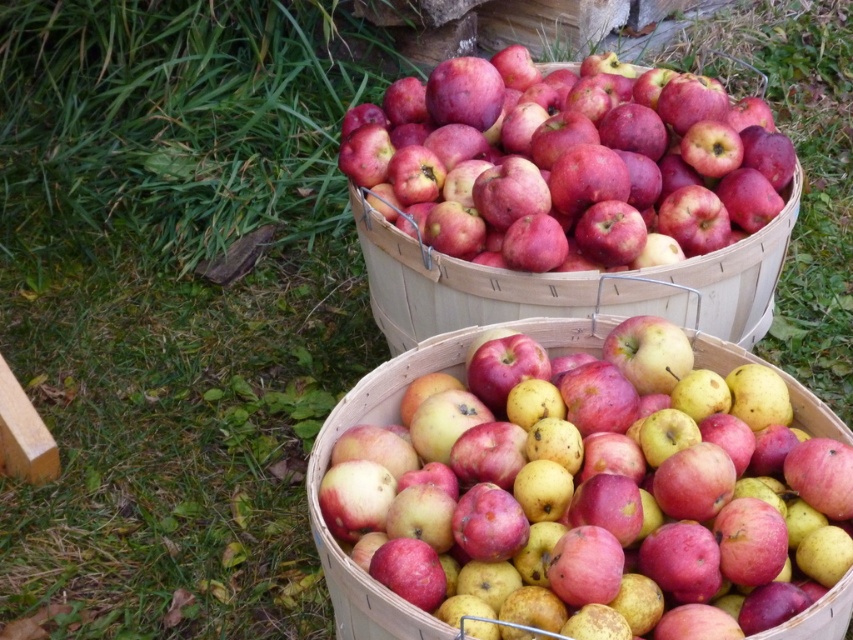
Can you confirm if shiny red apples at upper center is positioned to the right of shiny red apples at center?

Indeed, shiny red apples at upper center is positioned on the right side of shiny red apples at center.

Between point (677, 90) and point (381, 396), which one is positioned in front?

Positioned in front is point (381, 396).

Which is behind, point (631, 172) or point (374, 634)?

The point (631, 172) is more distant.

The image size is (853, 640). I want to click on shiny red apples at upper center, so click(566, 163).